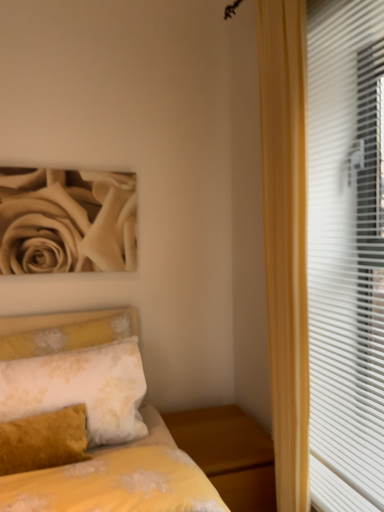
You are a GUI agent. You are given a task and a screenshot of the screen. Output one action in this format:
    pyautogui.click(x=<x>, y=<y>)
    Task: Click on the white floral fabric pillow at lower left
    The image size is (384, 512).
    Given the screenshot: What is the action you would take?
    pyautogui.click(x=80, y=388)

The image size is (384, 512). I want to click on wooden nightstand at lower right, so 229,454.

What are the coordinates of `yellow floral fabric bed at lower left` in the screenshot? It's located at (119, 479).

At what (x,y) coordinates should I click in order to perform the action: click on beige matte rose at upper left. Please return your answer as a coordinate pair (x, y). The width and height of the screenshot is (384, 512). Looking at the image, I should click on (67, 221).

From the picture: Is beige matte rose at upper left facing towards white plastic blinds at right?

No, beige matte rose at upper left is not facing towards white plastic blinds at right.

Where is `window blind on the right of beige matte rose at upper left`? The width and height of the screenshot is (384, 512). window blind on the right of beige matte rose at upper left is located at coordinates (346, 253).

From a real-world perspective, which is physically below, beige matte rose at upper left or white plastic blinds at right?

white plastic blinds at right.

From the image's perspective, is beige matte rose at upper left beneath white plastic blinds at right?

Actually, beige matte rose at upper left appears above white plastic blinds at right in the image.

Is white floral fabric pillow at lower left oriented towards white plastic blinds at right?

No, white floral fabric pillow at lower left does not turn towards white plastic blinds at right.

Can you confirm if white floral fabric pillow at lower left is shorter than white plastic blinds at right?

Yes.

Considering the relative positions of white floral fabric pillow at lower left and white plastic blinds at right in the image provided, is white floral fabric pillow at lower left to the right of white plastic blinds at right from the viewer's perspective?

Incorrect, white floral fabric pillow at lower left is not on the right side of white plastic blinds at right.

Between yellow floral fabric bed at lower left and wooden nightstand at lower right, which one has smaller width?

yellow floral fabric bed at lower left is thinner.

Which is in front, yellow floral fabric bed at lower left or wooden nightstand at lower right?

Positioned in front is yellow floral fabric bed at lower left.

This screenshot has width=384, height=512. Find the location of `nightstand behind the yellow floral fabric bed at lower left`. nightstand behind the yellow floral fabric bed at lower left is located at coordinates (229, 454).

From the picture: How distant is white plastic blinds at right from beige matte rose at upper left?

The distance of white plastic blinds at right from beige matte rose at upper left is 1.02 meters.

From a real-world perspective, is white plastic blinds at right located beneath beige matte rose at upper left?

Correct, in the physical world, white plastic blinds at right is lower than beige matte rose at upper left.

Between white plastic blinds at right and beige matte rose at upper left, which one has larger size?

With larger size is white plastic blinds at right.

Is white plastic blinds at right placed right next to beige matte rose at upper left?

No, white plastic blinds at right is not touching beige matte rose at upper left.

Is point (366, 443) farther from camera compared to point (113, 383)?

That is False.

Between white plastic blinds at right and white floral fabric pillow at lower left, which one is positioned in front?

white plastic blinds at right.

Can you confirm if white plastic blinds at right is taller than white floral fabric pillow at lower left?

Indeed, white plastic blinds at right has a greater height compared to white floral fabric pillow at lower left.

Would you say white plastic blinds at right is inside or outside white floral fabric pillow at lower left?

white plastic blinds at right lies outside white floral fabric pillow at lower left.

From the image's perspective, between yellow floral fabric bed at lower left and white floral fabric pillow at lower left, which one is located above?

white floral fabric pillow at lower left, from the image's perspective.

Would you say yellow floral fabric bed at lower left is outside white floral fabric pillow at lower left?

Yes.

In the image, is yellow floral fabric bed at lower left positioned in front of or behind white floral fabric pillow at lower left?

In the image, yellow floral fabric bed at lower left appears in front of white floral fabric pillow at lower left.

How distant is yellow floral fabric bed at lower left from white floral fabric pillow at lower left?

8.54 inches.

Is beige matte rose at upper left further to the viewer compared to white floral fabric pillow at lower left?

That is True.

Would you say beige matte rose at upper left is inside or outside white floral fabric pillow at lower left?

beige matte rose at upper left is outside white floral fabric pillow at lower left.

Is beige matte rose at upper left not close to white floral fabric pillow at lower left?

beige matte rose at upper left is actually quite close to white floral fabric pillow at lower left.

Considering the positions of points (130, 254) and (88, 375), is point (130, 254) closer to camera compared to point (88, 375)?

No, (130, 254) is further to viewer.

At what (x,y) coordinates should I click in order to perform the action: click on rose that is on the left side of white plastic blinds at right. Please return your answer as a coordinate pair (x, y). The image size is (384, 512). Looking at the image, I should click on [x=67, y=221].

What are the coordinates of `pillow that appears below the white plastic blinds at right (from the image's perspective)` in the screenshot? It's located at [x=80, y=388].

Based on their spatial positions, is wooden nightstand at lower right or white floral fabric pillow at lower left further from yellow floral fabric bed at lower left?

Among the two, wooden nightstand at lower right is located further to yellow floral fabric bed at lower left.

Considering their positions, is yellow floral fabric bed at lower left positioned further to white floral fabric pillow at lower left than white plastic blinds at right?

white plastic blinds at right is further to white floral fabric pillow at lower left.

Which object lies further to the anchor point beige matte rose at upper left, white plastic blinds at right or yellow floral fabric bed at lower left?

white plastic blinds at right.

From the image, which object appears to be nearer to white floral fabric pillow at lower left, wooden nightstand at lower right or beige matte rose at upper left?

The object closer to white floral fabric pillow at lower left is wooden nightstand at lower right.

Estimate the real-world distances between objects in this image. Which object is closer to white floral fabric pillow at lower left, yellow floral fabric bed at lower left or wooden nightstand at lower right?

yellow floral fabric bed at lower left.

Considering their positions, is wooden nightstand at lower right positioned further to white plastic blinds at right than yellow floral fabric bed at lower left?

yellow floral fabric bed at lower left.

Considering their positions, is beige matte rose at upper left positioned further to wooden nightstand at lower right than yellow floral fabric bed at lower left?

The object further to wooden nightstand at lower right is beige matte rose at upper left.

Based on their spatial positions, is beige matte rose at upper left or white floral fabric pillow at lower left further from white plastic blinds at right?

Based on the image, beige matte rose at upper left appears to be further to white plastic blinds at right.

Locate an element on the screen. This screenshot has width=384, height=512. pillow between white plastic blinds at right and wooden nightstand at lower right in the up-down direction is located at coordinates (80, 388).

The width and height of the screenshot is (384, 512). I want to click on window blind that lies between beige matte rose at upper left and wooden nightstand at lower right from top to bottom, so click(x=346, y=253).

Where is `bed between white plastic blinds at right and wooden nightstand at lower right from top to bottom`? bed between white plastic blinds at right and wooden nightstand at lower right from top to bottom is located at coordinates (x=119, y=479).

Identify the location of pillow located between beige matte rose at upper left and white plastic blinds at right in the left-right direction. (80, 388).